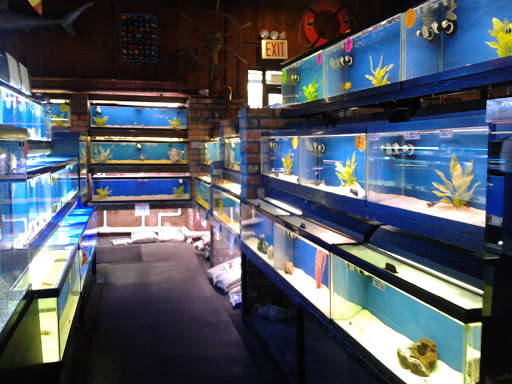
This screenshot has height=384, width=512. Identify the location of exit sign white. (278, 42).